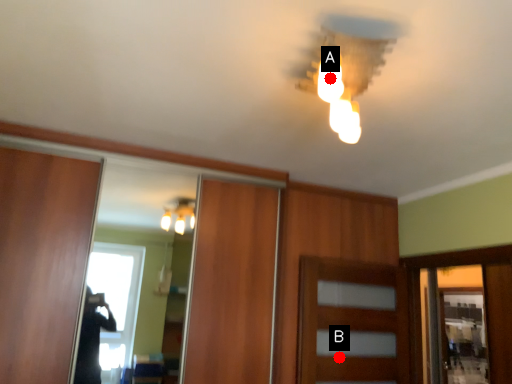
Question: Two points are circled on the image, labeled by A and B beside each circle. Which of the following is the farthest from the observer?

Choices:
 (A) A is further
 (B) B is further

Answer: (B)